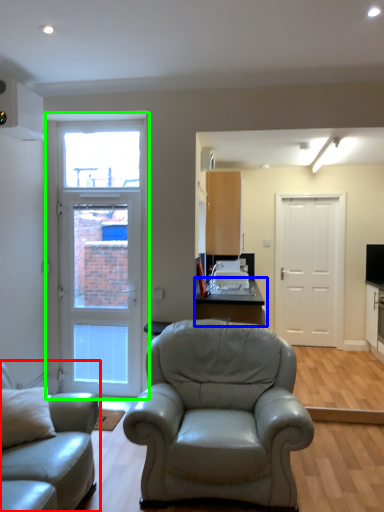
Question: Which object is positioned closest to studio couch (highlighted by a red box)? Select from table (highlighted by a blue box) and door (highlighted by a green box).

Choices:
 (A) table
 (B) door

Answer: (A)